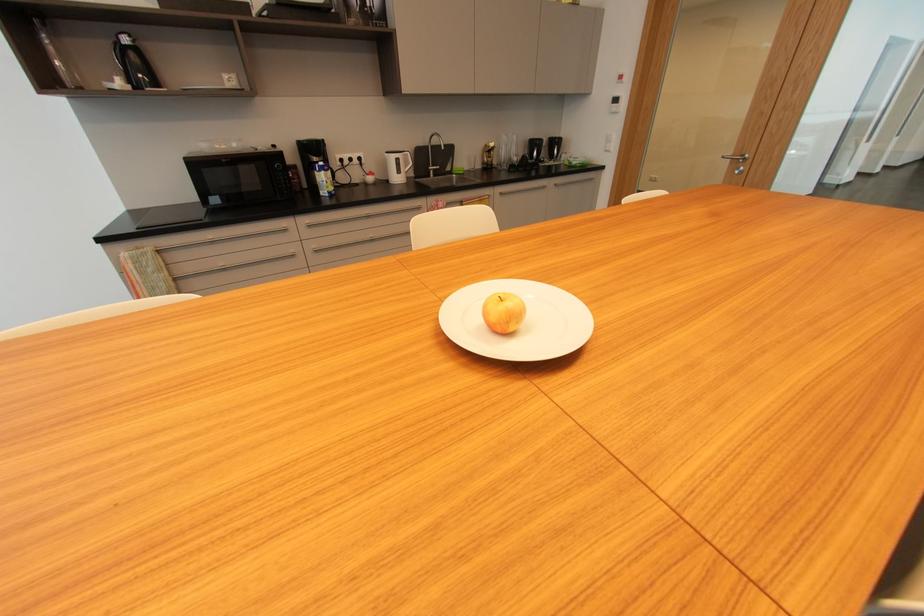
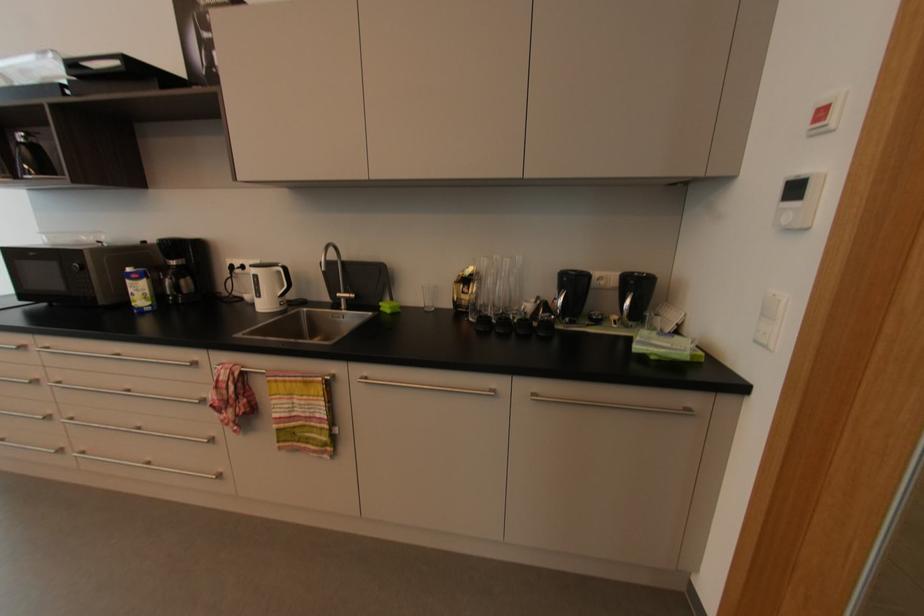
The point at (457,172) is marked in the first image. Where is the corresponding point in the second image?

(384, 309)